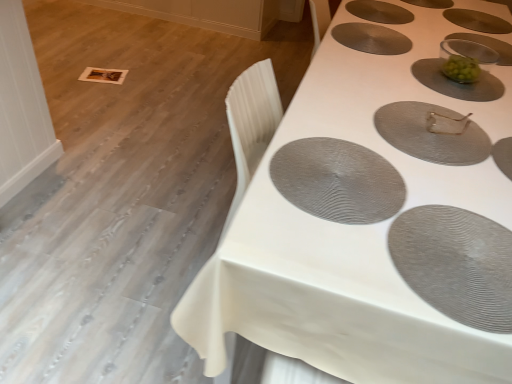
Find the location of `free space between matte gray placemat at center, placed as the third oval when sorted from front to back, and green matte bowl at upper right, the 4th oval from the front`. free space between matte gray placemat at center, placed as the third oval when sorted from front to back, and green matte bowl at upper right, the 4th oval from the front is located at coordinates (453, 105).